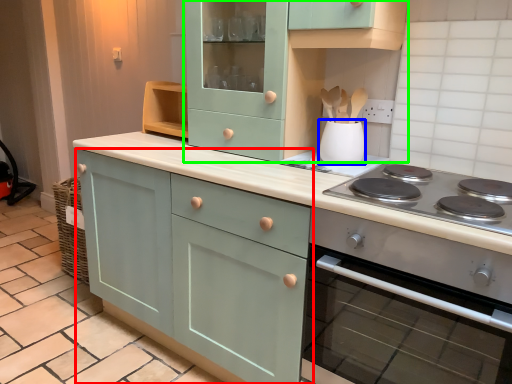
Question: Estimate the real-world distances between objects in this image. Which object is farther from cabinetry (highlighted by a red box), kitchen appliance (highlighted by a blue box) or cabinetry (highlighted by a green box)?

Choices:
 (A) kitchen appliance
 (B) cabinetry

Answer: (A)